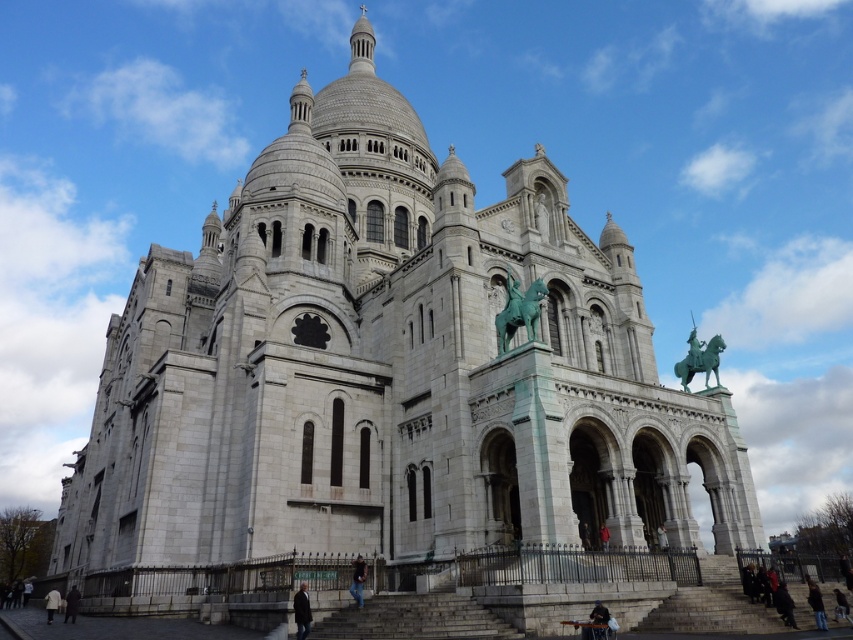
Question: Which point is closer to the camera taking this photo?

Choices:
 (A) [x=514, y=282]
 (B) [x=711, y=365]

Answer: (A)

Question: Is green patina metal horse at upper center positioned behind green patina statue at upper right?

Choices:
 (A) yes
 (B) no

Answer: (B)

Question: Which object is farther from the camera taking this photo?

Choices:
 (A) green patina metal horse at upper center
 (B) green patina statue at upper right

Answer: (B)

Question: Does green patina metal horse at upper center appear on the right side of green patina statue at upper right?

Choices:
 (A) no
 (B) yes

Answer: (A)

Question: Observing the image, what is the correct spatial positioning of green patina metal horse at upper center in reference to green patina statue at upper right?

Choices:
 (A) left
 (B) right

Answer: (A)